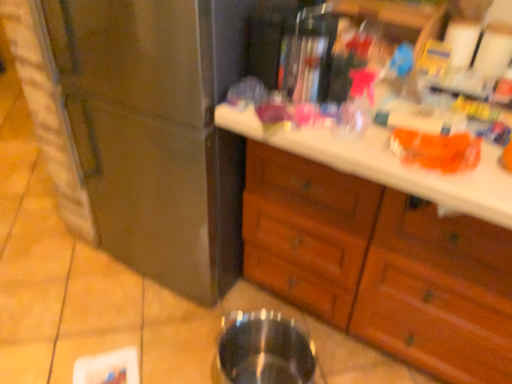
Question: Is transparent glass at lower center looking in the opposite direction of stainless steel refrigerator at left?

Choices:
 (A) yes
 (B) no

Answer: (B)

Question: Does transparent glass at lower center appear on the right side of stainless steel refrigerator at left?

Choices:
 (A) yes
 (B) no

Answer: (A)

Question: Is transparent glass at lower center further to camera compared to stainless steel refrigerator at left?

Choices:
 (A) no
 (B) yes

Answer: (B)

Question: Are transparent glass at lower center and stainless steel refrigerator at left making contact?

Choices:
 (A) no
 (B) yes

Answer: (A)

Question: Are transparent glass at lower center and stainless steel refrigerator at left far apart?

Choices:
 (A) no
 (B) yes

Answer: (A)

Question: Is transparent glass at lower center in front of or behind stainless steel refrigerator at left in the image?

Choices:
 (A) behind
 (B) front

Answer: (A)

Question: Based on their positions, is transparent glass at lower center located to the left or right of stainless steel refrigerator at left?

Choices:
 (A) left
 (B) right

Answer: (B)

Question: Considering the positions of transparent glass at lower center and stainless steel refrigerator at left in the image, is transparent glass at lower center wider or thinner than stainless steel refrigerator at left?

Choices:
 (A) wide
 (B) thin

Answer: (B)

Question: From the image's perspective, relative to stainless steel refrigerator at left, is transparent glass at lower center above or below?

Choices:
 (A) above
 (B) below

Answer: (B)

Question: From a real-world perspective, is wooden drawers at center positioned above or below stainless steel refrigerator at left?

Choices:
 (A) above
 (B) below

Answer: (B)

Question: Considering the positions of wooden drawers at center and stainless steel refrigerator at left in the image, is wooden drawers at center wider or thinner than stainless steel refrigerator at left?

Choices:
 (A) wide
 (B) thin

Answer: (B)

Question: Would you say wooden drawers at center is to the left or to the right of stainless steel refrigerator at left in the picture?

Choices:
 (A) left
 (B) right

Answer: (B)

Question: Is point (373, 273) positioned closer to the camera than point (234, 196)?

Choices:
 (A) closer
 (B) farther

Answer: (A)

Question: Choose the correct answer: Is stainless steel refrigerator at left inside wooden drawers at center or outside it?

Choices:
 (A) inside
 (B) outside

Answer: (B)

Question: From a real-world perspective, is stainless steel refrigerator at left positioned above or below wooden drawers at center?

Choices:
 (A) below
 (B) above

Answer: (B)